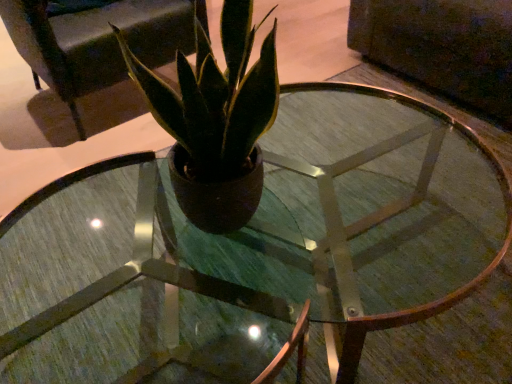
Question: In terms of height, does matte black armchair at upper center look taller or shorter compared to matte brown pot at center?

Choices:
 (A) tall
 (B) short

Answer: (A)

Question: Considering the positions of matte black armchair at upper center and matte brown pot at center in the image, is matte black armchair at upper center wider or thinner than matte brown pot at center?

Choices:
 (A) wide
 (B) thin

Answer: (A)

Question: Is matte black armchair at upper center in front of or behind matte brown pot at center in the image?

Choices:
 (A) front
 (B) behind

Answer: (B)

Question: From the image's perspective, is matte brown pot at center positioned above or below matte black armchair at upper center?

Choices:
 (A) above
 (B) below

Answer: (B)

Question: From their relative heights in the image, would you say matte brown pot at center is taller or shorter than matte black armchair at upper center?

Choices:
 (A) short
 (B) tall

Answer: (A)

Question: In the image, is matte brown pot at center on the left side or the right side of matte black armchair at upper center?

Choices:
 (A) right
 (B) left

Answer: (A)

Question: In terms of width, does matte brown pot at center look wider or thinner when compared to matte black armchair at upper center?

Choices:
 (A) wide
 (B) thin

Answer: (B)